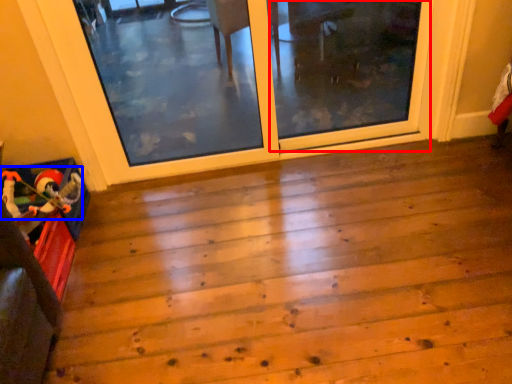
Question: Among these objects, which one is farthest to the camera, screen door (highlighted by a red box) or toy (highlighted by a blue box)?

Choices:
 (A) screen door
 (B) toy

Answer: (A)